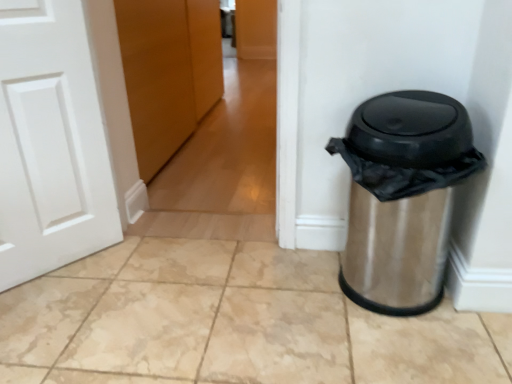
You are a GUI agent. You are given a task and a screenshot of the screen. Output one action in this format:
    pyautogui.click(x=<x>, y=<y>)
    Task: Click on the free space underneath stainless steel trash can at right (from a real-world perspective)
    The height and width of the screenshot is (384, 512).
    Given the screenshot: What is the action you would take?
    pyautogui.click(x=379, y=294)